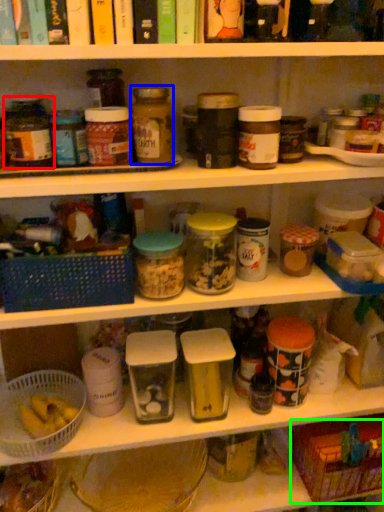
Question: Which object is positioned closest to bottle (highlighted by a red box)? Select from bottle (highlighted by a blue box) and basket (highlighted by a green box).

Choices:
 (A) bottle
 (B) basket

Answer: (A)